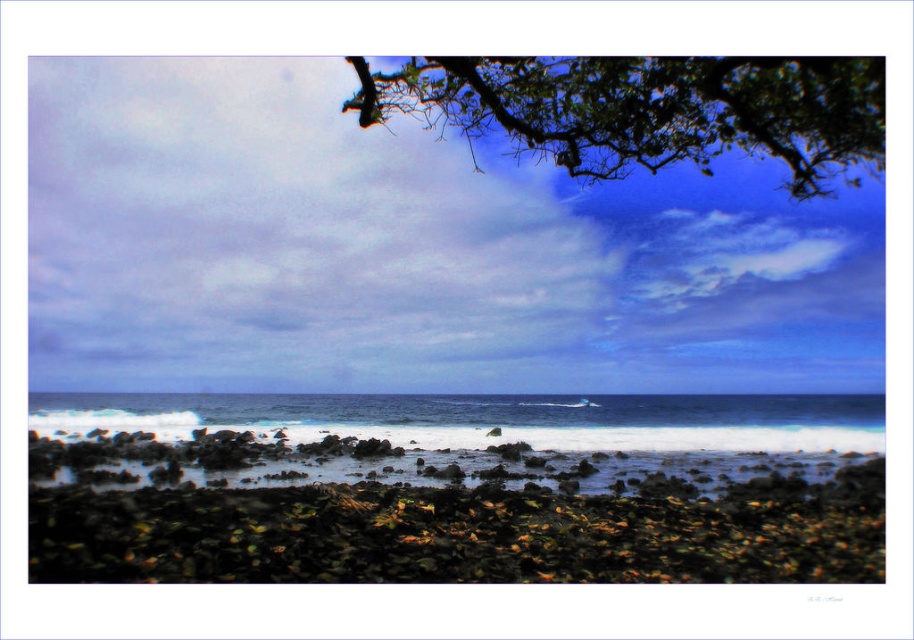
Question: Does white frothy water at center have a larger size compared to green leafy tree at upper center?

Choices:
 (A) no
 (B) yes

Answer: (A)

Question: Is white frothy water at center below green leafy tree at upper center?

Choices:
 (A) no
 (B) yes

Answer: (B)

Question: Which point appears closest to the camera in this image?

Choices:
 (A) (845, 99)
 (B) (515, 428)

Answer: (A)

Question: Does white frothy water at center lie behind green leafy tree at upper center?

Choices:
 (A) no
 (B) yes

Answer: (B)